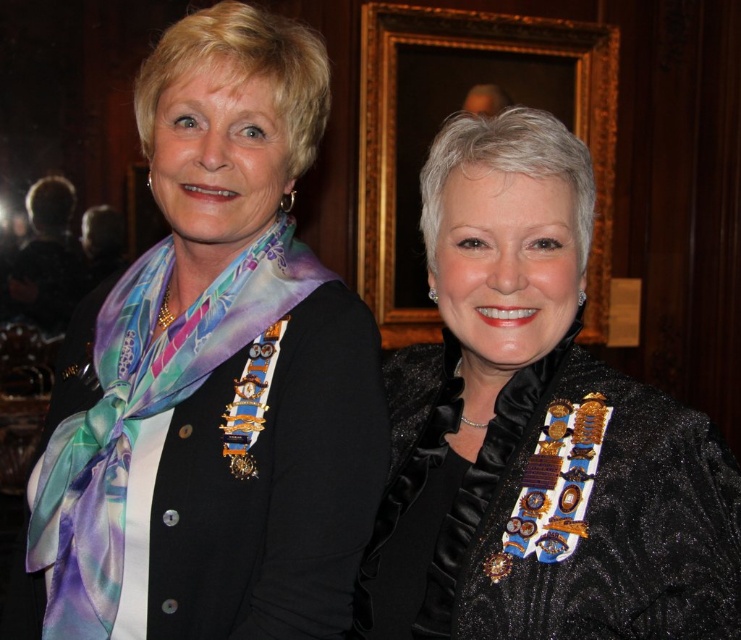
How distant is black satin jacket at center from silky multicolored scarf at left?

black satin jacket at center is 17.44 inches from silky multicolored scarf at left.

Does black satin jacket at center have a larger size compared to silky multicolored scarf at left?

Yes.

Where is `black satin jacket at center`? The image size is (741, 640). black satin jacket at center is located at coordinates (536, 429).

Is wooden frame at upper center positioned at the back of silky multicolored scarf at left?

Yes, wooden frame at upper center is behind silky multicolored scarf at left.

Who is more distant from viewer, (x=433, y=308) or (x=30, y=563)?

The point (x=433, y=308) is more distant.

The height and width of the screenshot is (640, 741). What are the coordinates of `wooden frame at upper center` in the screenshot? It's located at (451, 109).

At what (x,y) coordinates should I click in order to perform the action: click on black satin jacket at center. Please return your answer as a coordinate pair (x, y). Looking at the image, I should click on (536, 429).

Is black satin jacket at center above wooden frame at upper center?

No, black satin jacket at center is not above wooden frame at upper center.

Is point (459, 282) less distant than point (385, 44)?

Yes, it is in front of point (385, 44).

Locate an element on the screen. black satin jacket at center is located at coordinates (536, 429).